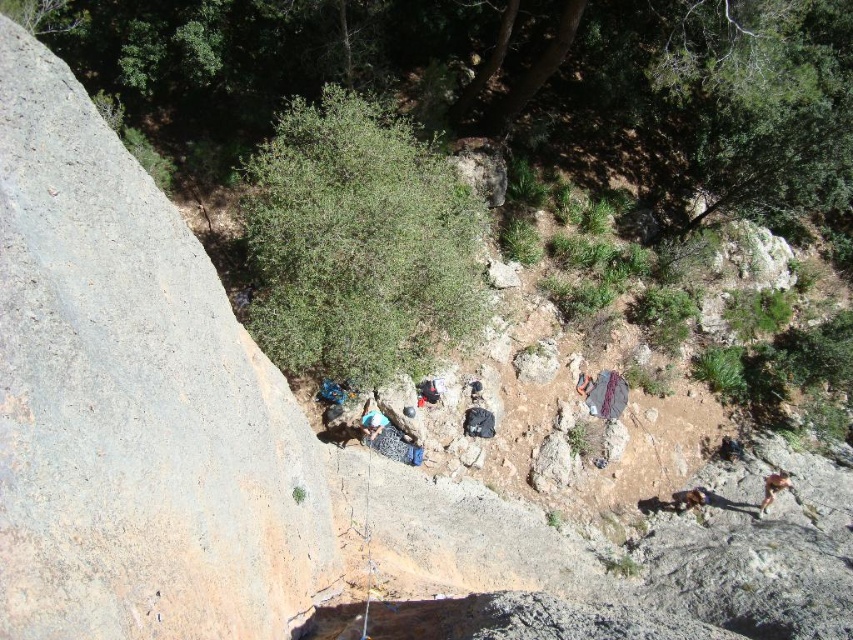
Can you confirm if gray rough rock at left is smaller than camouflage fabric bag at center?

Indeed, gray rough rock at left has a smaller size compared to camouflage fabric bag at center.

Does point (143, 186) come farther from viewer compared to point (366, 410)?

No, it is in front of (366, 410).

Where is `gray rough rock at left`? The width and height of the screenshot is (853, 640). gray rough rock at left is located at coordinates (132, 403).